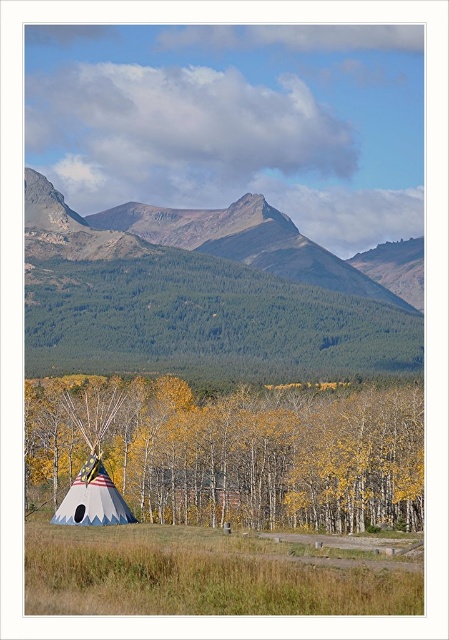
Can you confirm if green forested mountain at upper center is positioned below american flag fabric teepee at lower left?

Incorrect, green forested mountain at upper center is not positioned below american flag fabric teepee at lower left.

Who is more distant from viewer, [190,355] or [101,493]?

The point [190,355] is behind.

Where is `green forested mountain at upper center`? green forested mountain at upper center is located at coordinates (189, 307).

The image size is (449, 640). What are the coordinates of `green forested mountain at upper center` in the screenshot? It's located at (189, 307).

Which is behind, point (164, 429) or point (91, 483)?

The point (164, 429) is more distant.

I want to click on white fabric teepee at lower left, so click(271, 458).

Does green forested mountain at upper center come in front of white fabric teepee at lower left?

No, green forested mountain at upper center is behind white fabric teepee at lower left.

You are a GUI agent. You are given a task and a screenshot of the screen. Output one action in this format:
    pyautogui.click(x=<x>, y=<y>)
    Task: Click on the green forested mountain at upper center
    
    Given the screenshot: What is the action you would take?
    pyautogui.click(x=189, y=307)

Between point (299, 248) and point (199, 403), which one is positioned in front?

Point (199, 403) is in front.

Locate an element on the screen. Image resolution: width=449 pixels, height=640 pixels. green forested mountain at upper center is located at coordinates (189, 307).